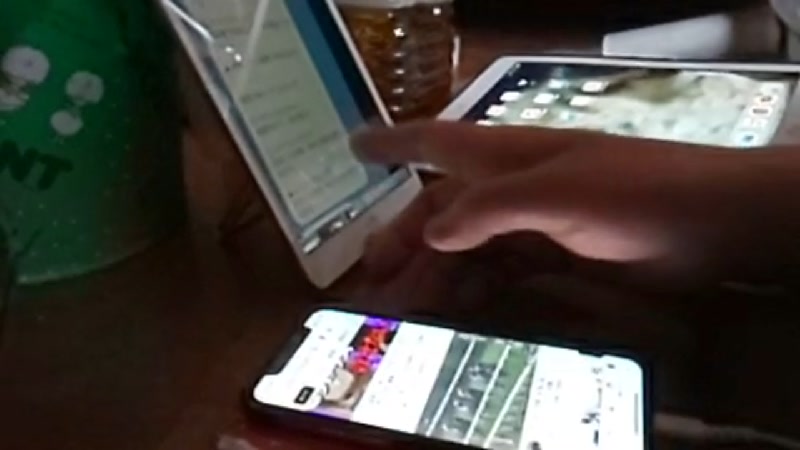
You are a GUI agent. You are given a task and a screenshot of the screen. Output one action in this format:
    pyautogui.click(x=<x>, y=<y>)
    Task: Click on the table
    
    Given the screenshot: What is the action you would take?
    pyautogui.click(x=90, y=344)